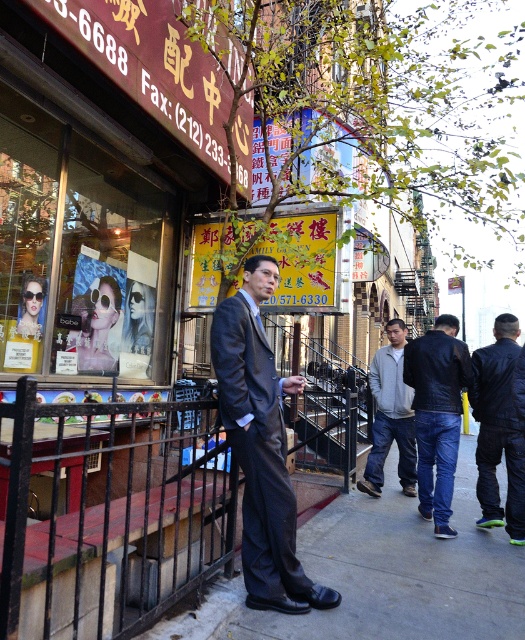
Question: Is shiny brown suit at center positioned at the back of leather jacket at right?

Choices:
 (A) no
 (B) yes

Answer: (A)

Question: Among these points, which one is farthest from the camera?

Choices:
 (A) (270, 579)
 (B) (475, 401)
 (C) (454, 550)
 (D) (422, 388)

Answer: (B)

Question: Is shiny brown suit at center above dark blue leather jacket at right?

Choices:
 (A) yes
 (B) no

Answer: (A)

Question: Which point appears farthest from the camera in this image?

Choices:
 (A) (501, 552)
 (B) (500, 452)
 (C) (374, 396)

Answer: (C)

Question: Observing the image, what is the correct spatial positioning of concrete sidewalk at center in reference to dark blue leather jacket at right?

Choices:
 (A) left
 (B) right

Answer: (A)

Question: Which object appears closest to the camera in this image?

Choices:
 (A) shiny brown suit at center
 (B) gray fleece jacket at center

Answer: (A)